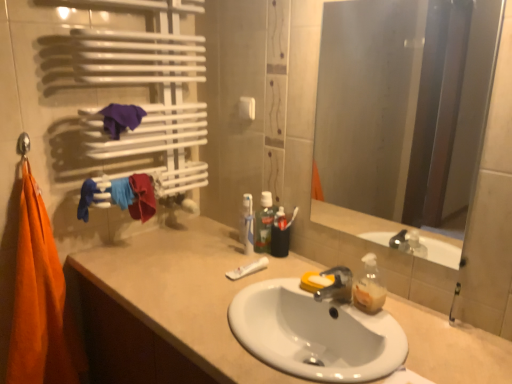
Question: From the image's perspective, is smooth glass mirror at center positioned above or below green translucent mouthwash at center?

Choices:
 (A) above
 (B) below

Answer: (A)

Question: Considering the relative positions of smooth glass mirror at center and green translucent mouthwash at center in the image provided, is smooth glass mirror at center to the left or to the right of green translucent mouthwash at center?

Choices:
 (A) left
 (B) right

Answer: (B)

Question: Based on their relative distances, which object is farther from the orange cotton towel at left, placed as the 2th beach towel when sorted from top to bottom?

Choices:
 (A) smooth glass mirror at center
 (B) beige matte cabinet at lower left
 (C) purple fabric at upper left, the first beach towel positioned from the right
 (D) translucent plastic toothpaste at center
 (E) green translucent mouthwash at center

Answer: (A)

Question: Which is farther from the smooth glass mirror at center?

Choices:
 (A) translucent plastic toothpaste at center
 (B) white ceramic sink at center
 (C) purple fabric at upper left, positioned as the 2th beach towel in bottom-to-top order
 (D) beige matte cabinet at lower left
 (E) orange cotton towel at left, which is the first beach towel in bottom-to-top order

Answer: (C)